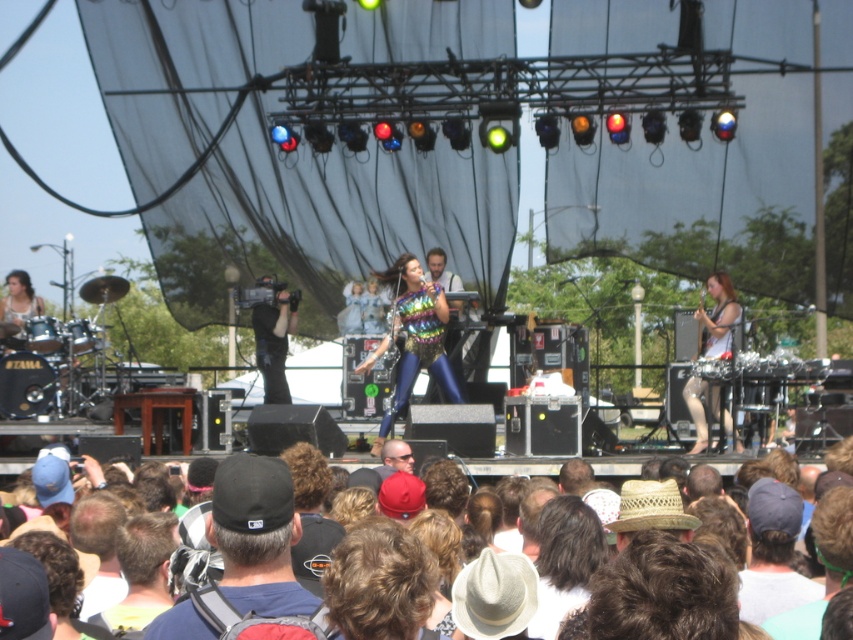
You are a photographer at the concert and want to capture a closeup of the black fabric cap at center. The camera you are using has a zoom range that can focus on objects within a 0.1 radius around any point. Is the black fabric cap at center within the zoom range of your camera if you aim it at point (257, 536)?

The black fabric cap at center is located exactly at point (257, 536), so it will be within the camera zoom range of 0.1 radius around that point.

Based on the photo, you are a photographer at the concert and want to capture a photo of the lead singer wearing the black fabric cap at center and the metallic silver microphone at right. Which object is closer to the left side of the frame?

The black fabric cap at center is positioned on the left side of the metallic silver microphone at right, so it is closer to the left side of the frame.